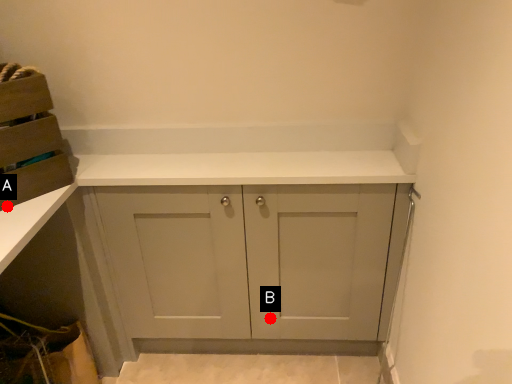
Question: Two points are circled on the image, labeled by A and B beside each circle. Which point is further to the camera?

Choices:
 (A) A is further
 (B) B is further

Answer: (B)